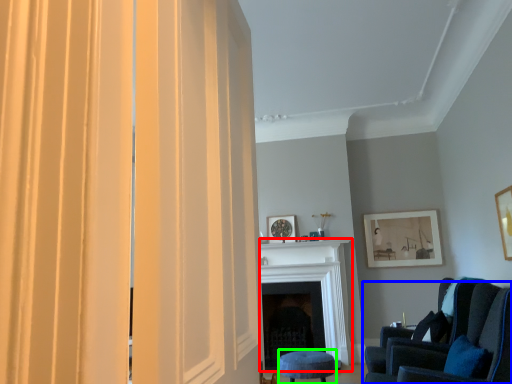
Question: Based on their relative distances, which object is nearer to fireplace (highlighted by a red box)? Choose from chair (highlighted by a blue box) and stool (highlighted by a green box).

Choices:
 (A) chair
 (B) stool

Answer: (B)